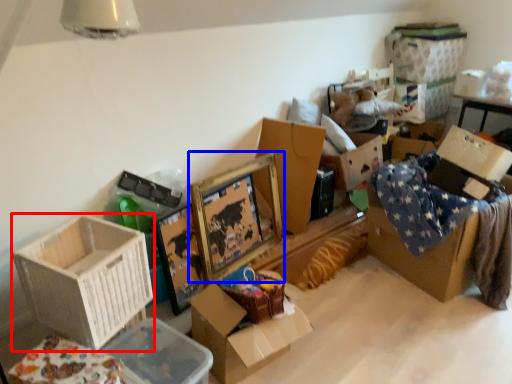
Question: Which point is closer to the camera, box (highlighted by a red box) or picture frame (highlighted by a blue box)?

Choices:
 (A) box
 (B) picture frame

Answer: (A)